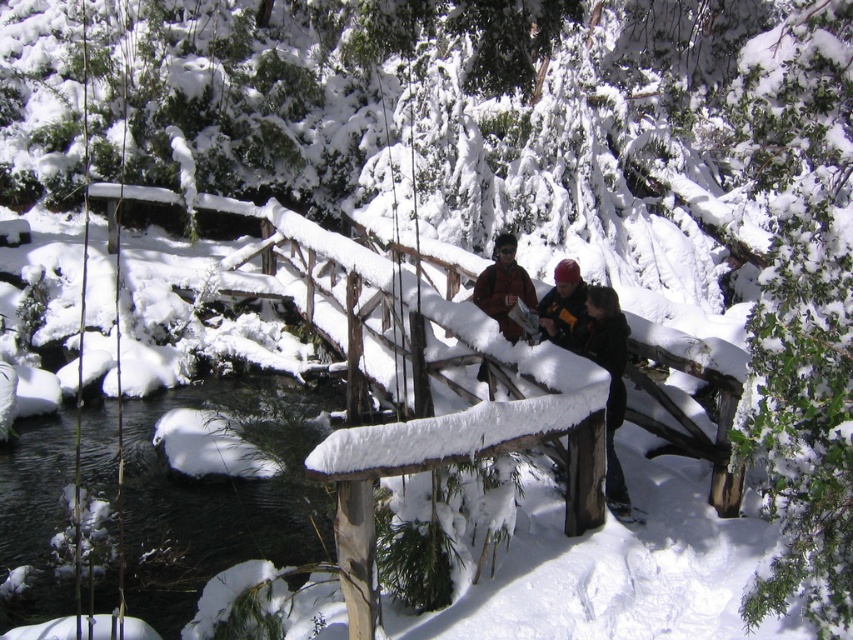
Can you confirm if black leather jacket at center is positioned to the right of matte black helmet at center?

Correct, you'll find black leather jacket at center to the right of matte black helmet at center.

In the scene shown: Between black leather jacket at center and matte black helmet at center, which one is positioned higher?

matte black helmet at center

I want to click on black leather jacket at center, so click(610, 381).

Is the position of dark brown leather jacket at center less distant than that of matte black helmet at center?

That is True.

Which is in front, point (614, 296) or point (572, 272)?

Point (614, 296) is more forward.

Find the location of a particular element. The width and height of the screenshot is (853, 640). dark brown leather jacket at center is located at coordinates (592, 355).

From the picture: Is the position of clear water at center more distant than that of dark brown leather jacket at center?

Yes, clear water at center is behind dark brown leather jacket at center.

Is clear water at center smaller than dark brown leather jacket at center?

Indeed, clear water at center has a smaller size compared to dark brown leather jacket at center.

Does point (231, 540) come farther from viewer compared to point (625, 340)?

Yes, point (231, 540) is farther from viewer.

Image resolution: width=853 pixels, height=640 pixels. I want to click on clear water at center, so click(x=210, y=506).